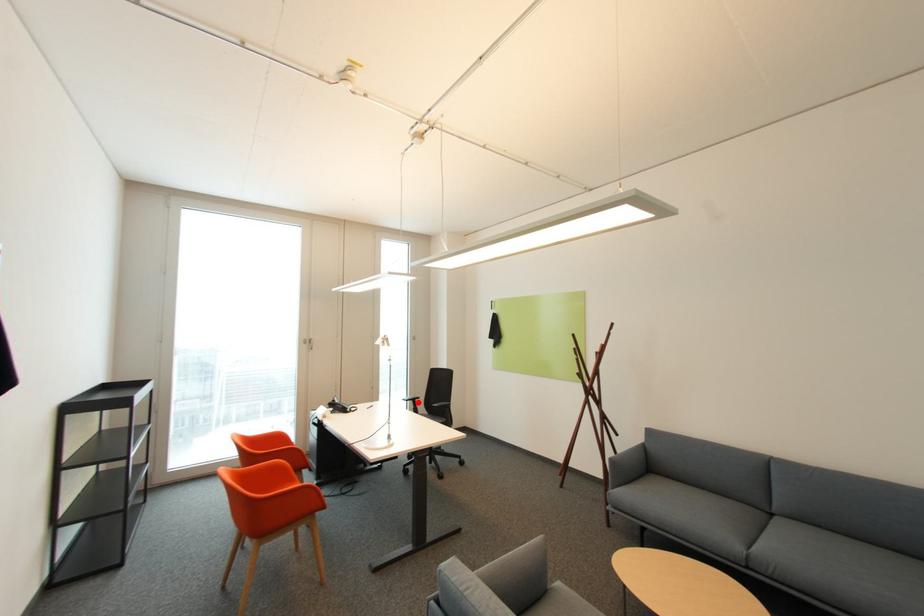
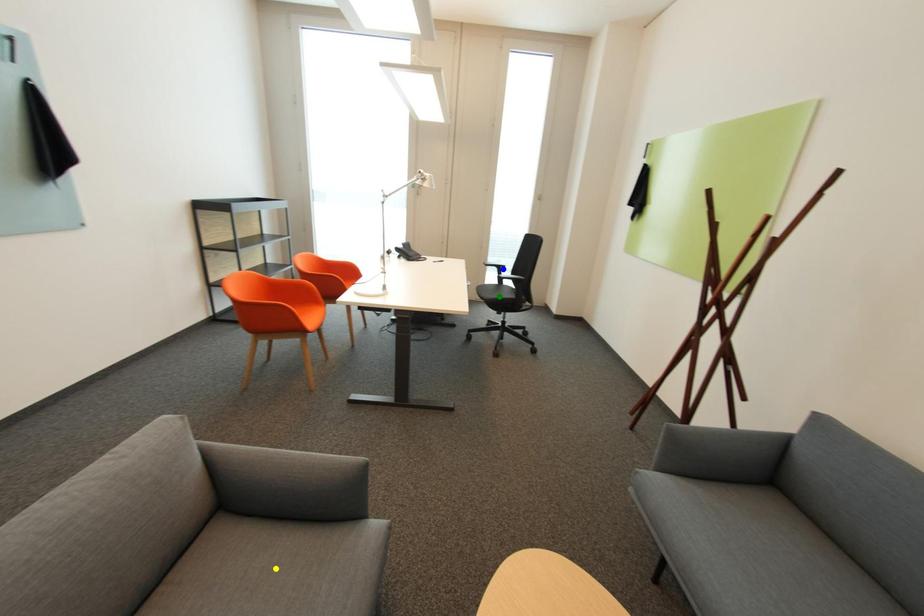
Question: I am providing you with two images of the same scene from different viewpoints. A red point is marked on the first image. You are given multiple points on the second image. Which spot in image 2 lines up with the point in image 1?

Choices:
 (A) yellow point
 (B) blue point
 (C) green point

Answer: (B)